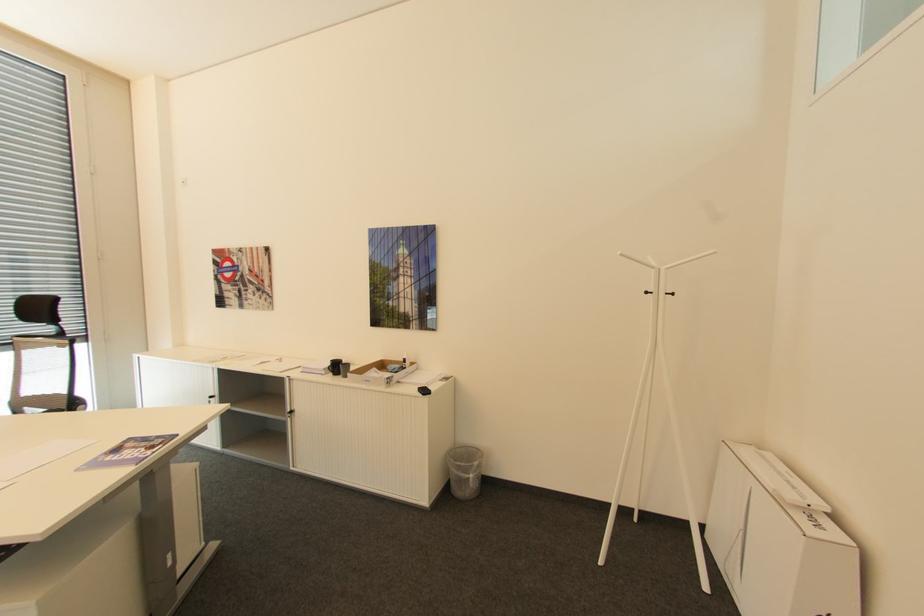
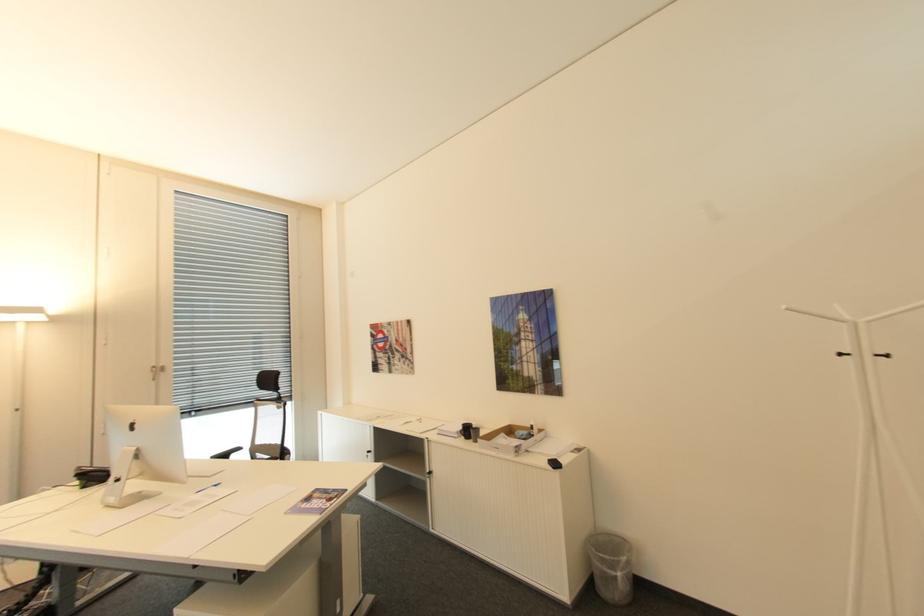
Where in the second image is the point corresponding to point 470,476 from the first image?

(617, 570)